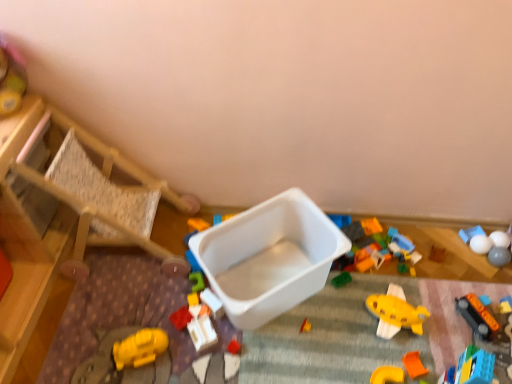
Locate an element on the screen. The height and width of the screenshot is (384, 512). free spot to the right of rubberized plastic toy at center, which ranks as the 2th toy in left-to-right order is located at coordinates click(243, 334).